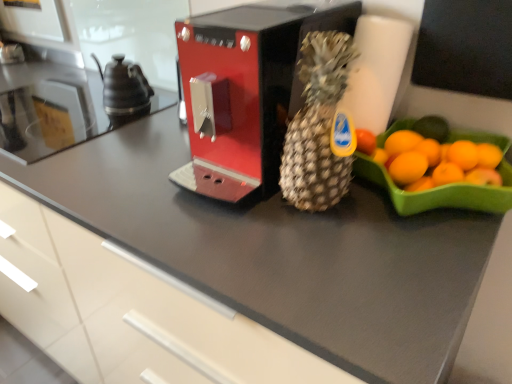
Question: Is black ceramic tea pot at left to the left or to the right of metallic red coffee machine at center in the image?

Choices:
 (A) right
 (B) left

Answer: (B)

Question: In terms of size, does black ceramic tea pot at left appear bigger or smaller than metallic red coffee machine at center?

Choices:
 (A) big
 (B) small

Answer: (B)

Question: Based on their relative distances, which object is farther from the black ceramic tea pot at left?

Choices:
 (A) satin black countertop at left
 (B) brown textured pineapple at center
 (C) metallic red coffee machine at center

Answer: (B)

Question: Based on their relative distances, which object is nearer to the satin black countertop at left?

Choices:
 (A) brown textured pineapple at center
 (B) metallic red coffee machine at center
 (C) black ceramic tea pot at left

Answer: (C)